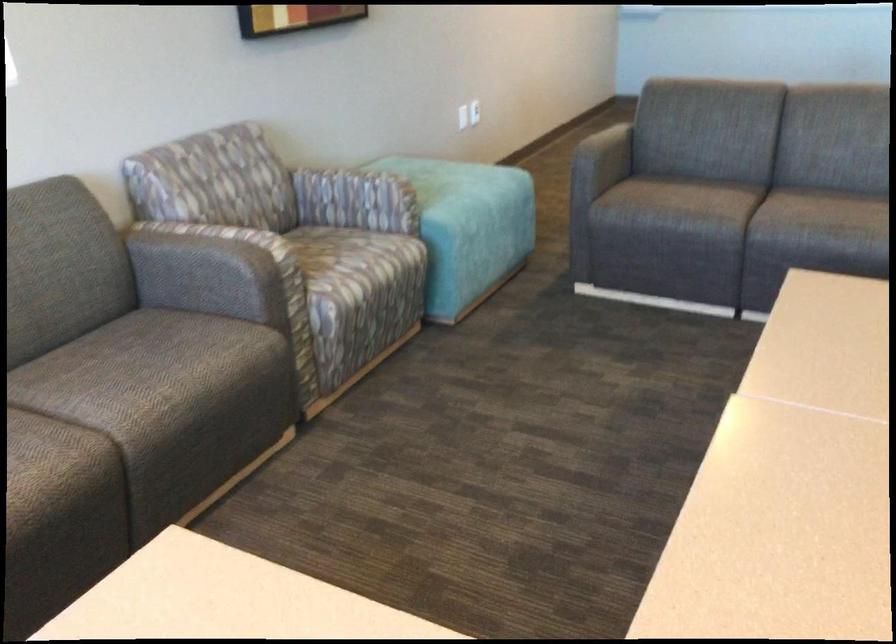
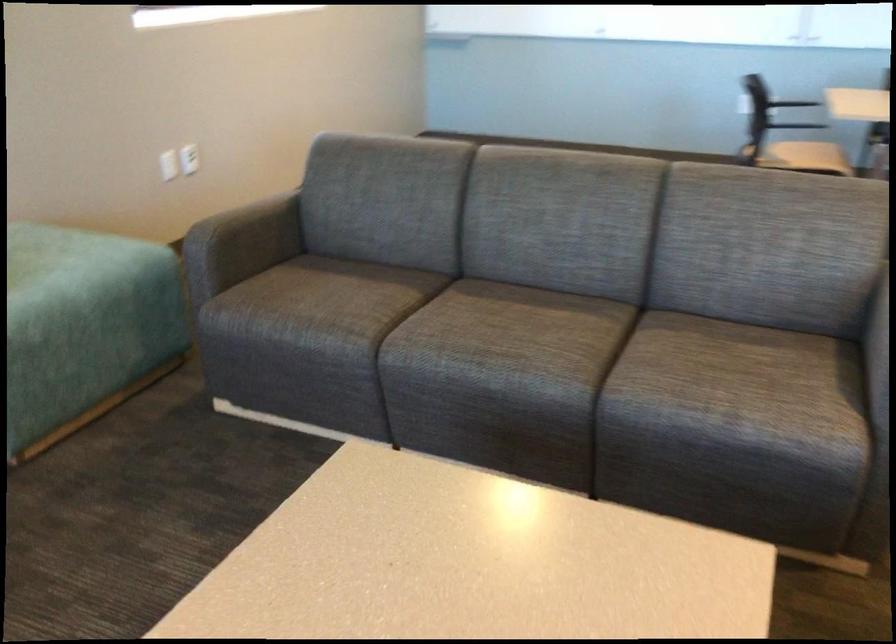
Where in the second image is the point corresponding to point (451, 111) from the first image?

(168, 165)